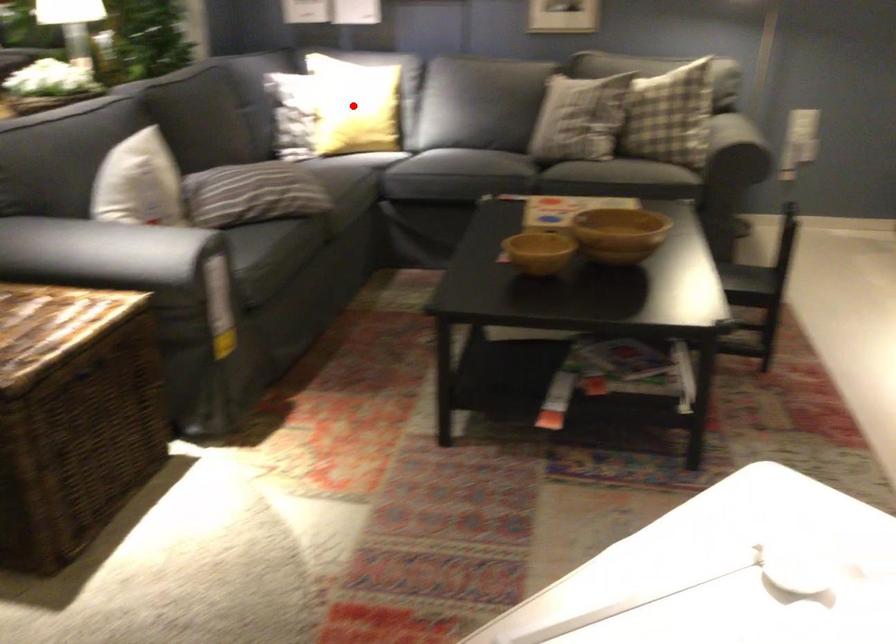
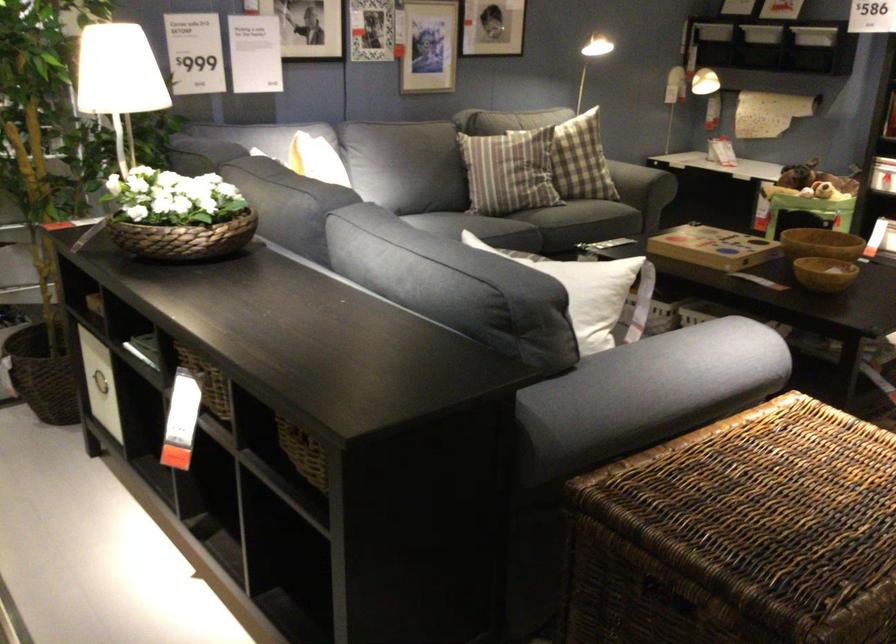
Question: I am providing you with two images of the same scene from different viewpoints. A red point is marked on the first image. Can you still see the location of the red point in image 2?

Choices:
 (A) Yes
 (B) No

Answer: (B)